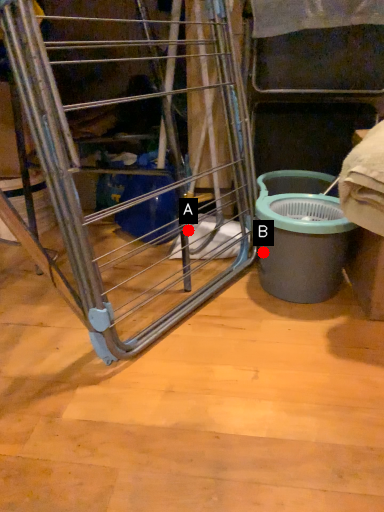
Question: Two points are circled on the image, labeled by A and B beside each circle. Among these points, which one is farthest from the camera?

Choices:
 (A) A is further
 (B) B is further

Answer: (A)